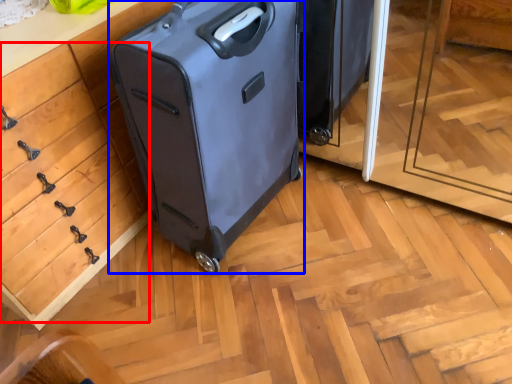
Question: Among these objects, which one is farthest to the camera, drawer (highlighted by a red box) or suitcase (highlighted by a blue box)?

Choices:
 (A) drawer
 (B) suitcase

Answer: (B)